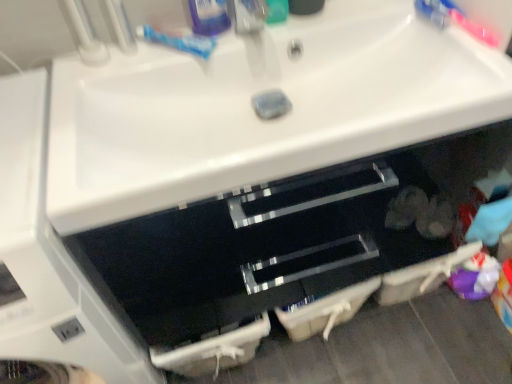
Where is `vacant area that lies to the right of green plastic toothpaste tube at upper center, the 1th toiletry in the right-to-left sequence`? vacant area that lies to the right of green plastic toothpaste tube at upper center, the 1th toiletry in the right-to-left sequence is located at coordinates (353, 21).